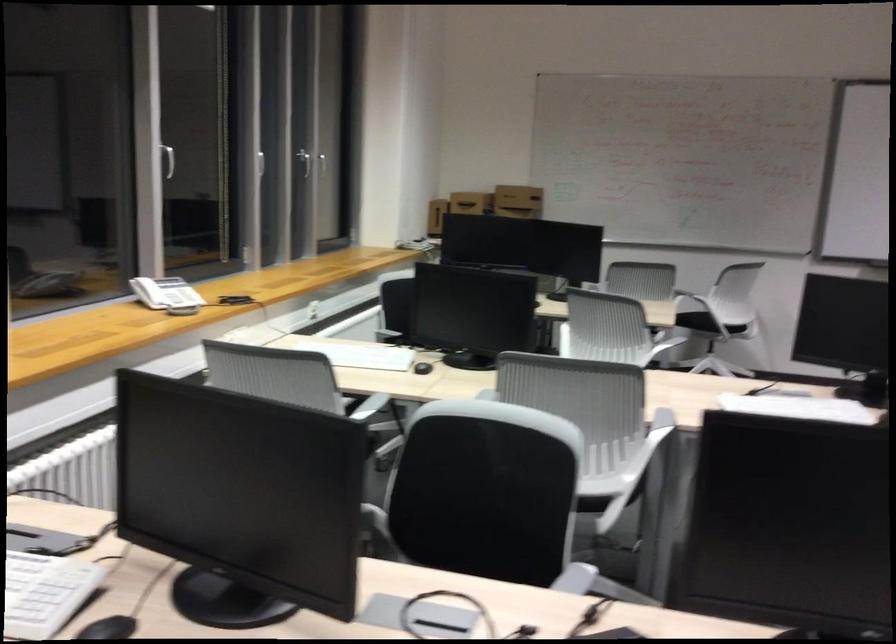
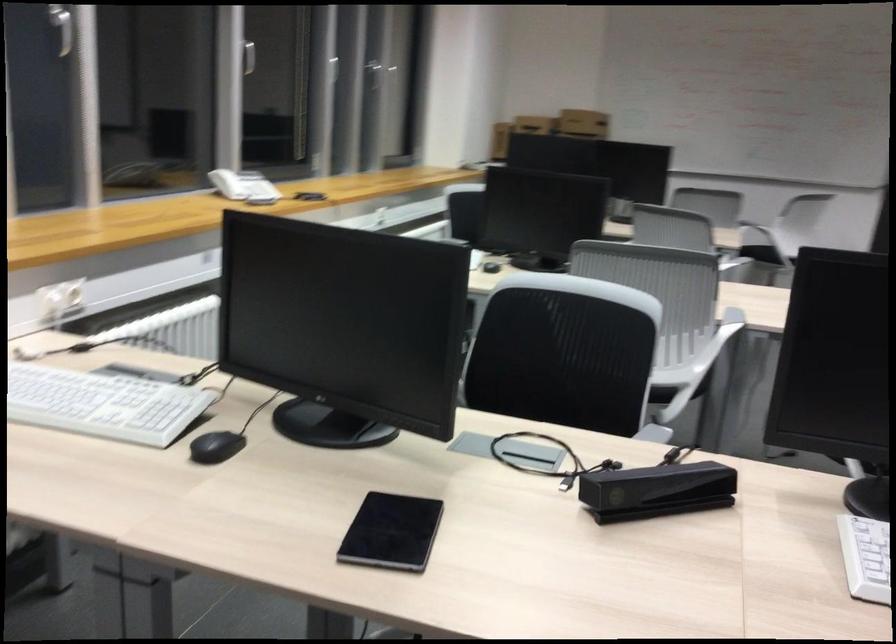
In the second image, find the point that corresponds to [596,503] in the first image.

(661, 395)